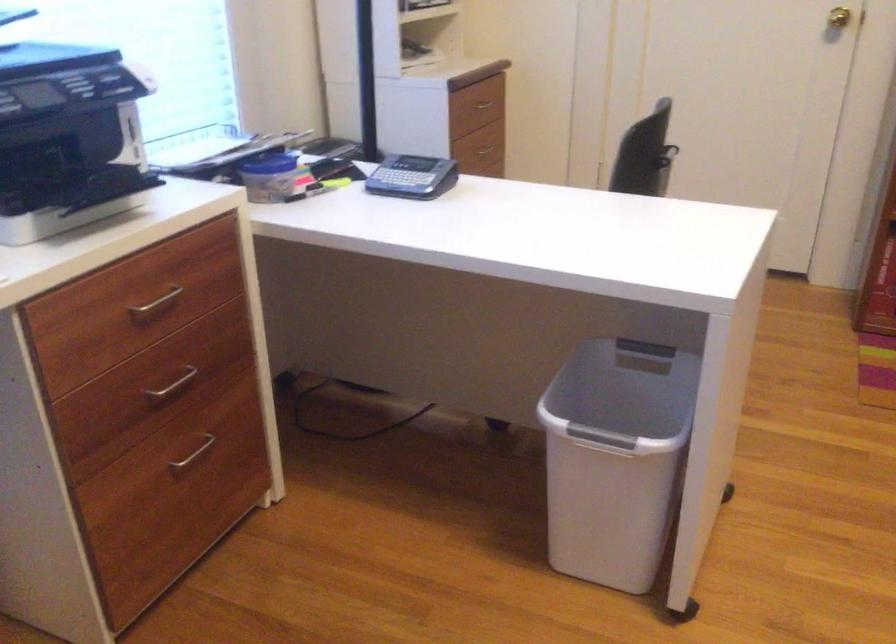
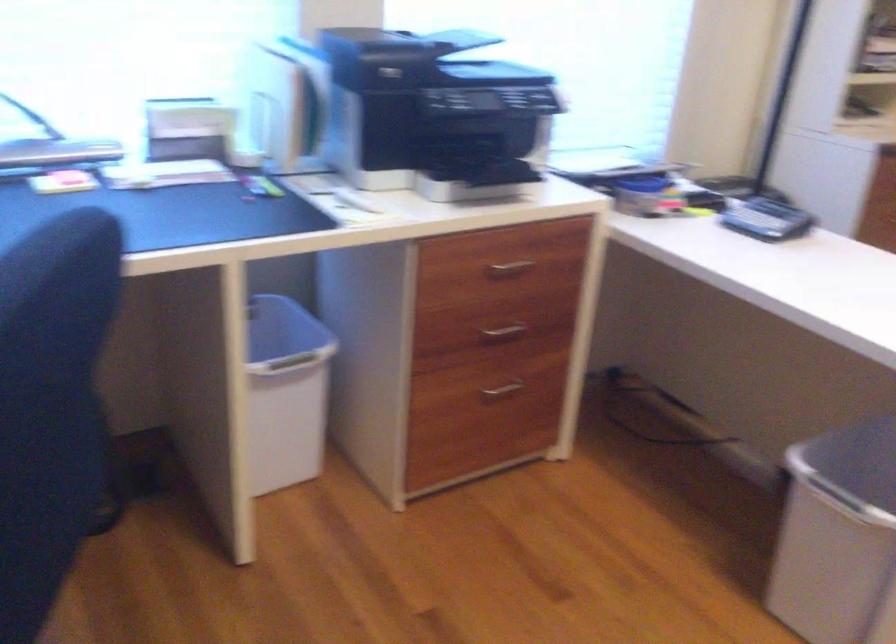
The point at (x=187, y=453) is marked in the first image. Where is the corresponding point in the second image?

(501, 388)